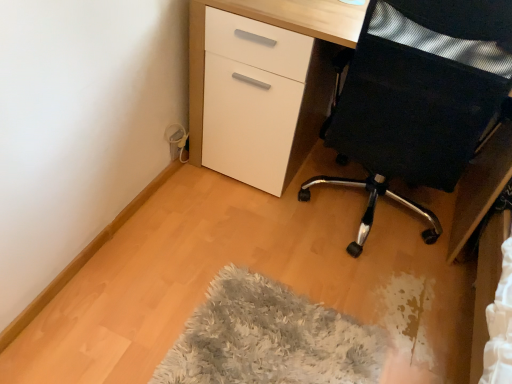
Question: Is the position of fluffy gray mat at lower center more distant than that of white glossy desk at center?

Choices:
 (A) yes
 (B) no

Answer: (B)

Question: From a real-world perspective, is fluffy gray mat at lower center positioned under white glossy desk at center based on gravity?

Choices:
 (A) no
 (B) yes

Answer: (B)

Question: Can you confirm if fluffy gray mat at lower center is positioned to the left of white glossy desk at center?

Choices:
 (A) no
 (B) yes

Answer: (B)

Question: Is fluffy gray mat at lower center placed right next to white glossy desk at center?

Choices:
 (A) no
 (B) yes

Answer: (A)

Question: Is fluffy gray mat at lower center to the right of white glossy desk at center from the viewer's perspective?

Choices:
 (A) yes
 (B) no

Answer: (B)

Question: From their relative heights in the image, would you say black mesh chair at right is taller or shorter than white glossy desk at center?

Choices:
 (A) short
 (B) tall

Answer: (B)

Question: From a real-world perspective, is black mesh chair at right above or below white glossy desk at center?

Choices:
 (A) below
 (B) above

Answer: (B)

Question: From the image's perspective, is black mesh chair at right located above or below white glossy desk at center?

Choices:
 (A) below
 (B) above

Answer: (A)

Question: Is black mesh chair at right bigger or smaller than white glossy desk at center?

Choices:
 (A) big
 (B) small

Answer: (B)

Question: From a real-world perspective, is fluffy gray mat at lower center above or below white glossy desk at center?

Choices:
 (A) above
 (B) below

Answer: (B)

Question: Considering their positions, is fluffy gray mat at lower center located in front of or behind white glossy desk at center?

Choices:
 (A) front
 (B) behind

Answer: (A)

Question: Which is correct: fluffy gray mat at lower center is inside white glossy desk at center, or outside of it?

Choices:
 (A) inside
 (B) outside

Answer: (B)

Question: Considering the positions of fluffy gray mat at lower center and white glossy desk at center in the image, is fluffy gray mat at lower center taller or shorter than white glossy desk at center?

Choices:
 (A) tall
 (B) short

Answer: (B)

Question: From their relative heights in the image, would you say white glossy desk at center is taller or shorter than black mesh chair at right?

Choices:
 (A) tall
 (B) short

Answer: (B)

Question: Considering the positions of white glossy desk at center and black mesh chair at right in the image, is white glossy desk at center bigger or smaller than black mesh chair at right?

Choices:
 (A) big
 (B) small

Answer: (A)